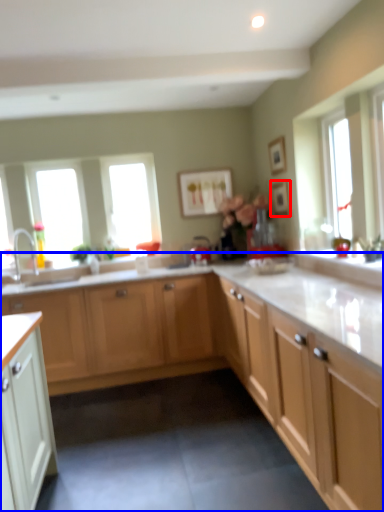
Question: Among these objects, which one is nearest to the camera, picture frame (highlighted by a red box) or cabinetry (highlighted by a blue box)?

Choices:
 (A) picture frame
 (B) cabinetry

Answer: (B)